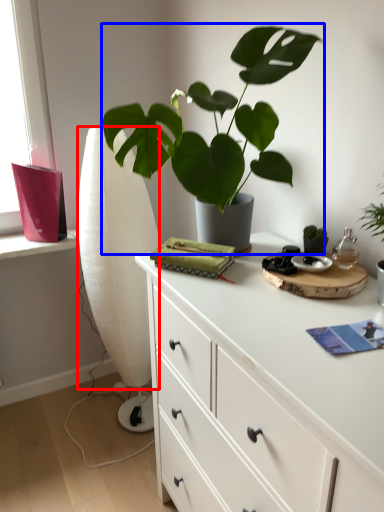
Question: Among these objects, which one is nearest to the camera, curtain (highlighted by a red box) or houseplant (highlighted by a blue box)?

Choices:
 (A) curtain
 (B) houseplant

Answer: (B)